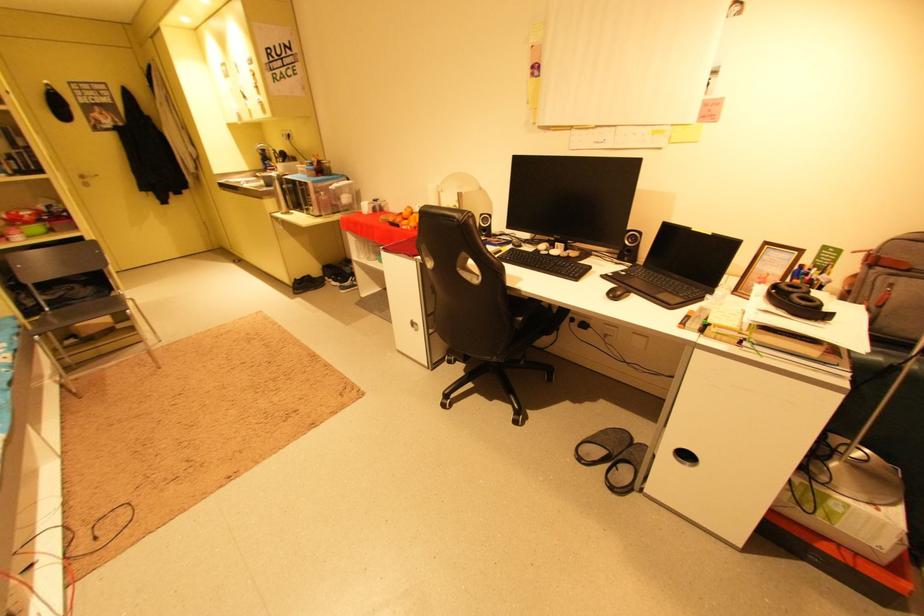
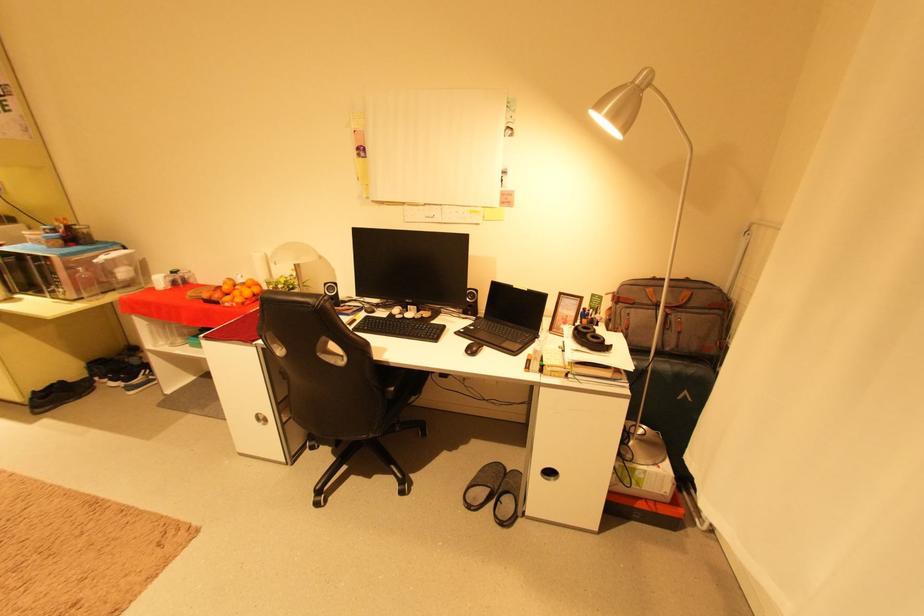
Find the pixel in the second image that matches point (718, 235) in the first image.

(533, 291)